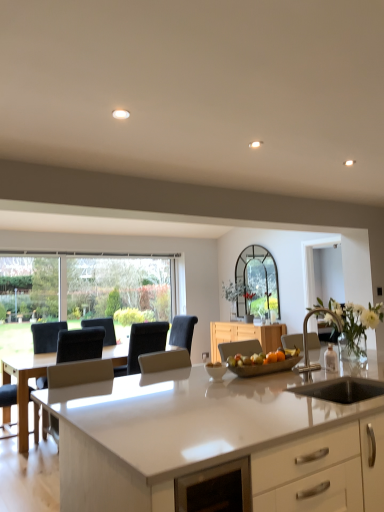
The image size is (384, 512). What are the coordinates of `free region on the left part of satin silver armchair at center, marked as the 3th armchair in a left-to-right arrangement` in the screenshot? It's located at (273, 384).